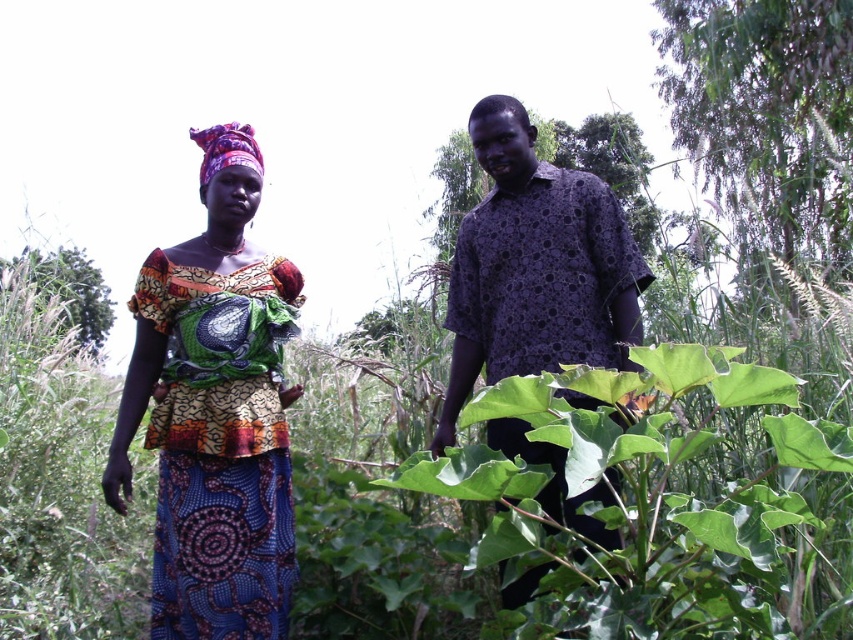
You are a farmer checking the growth of your plants. You notice the green leafy plant at center and the purple printed shirt at center. Which object is shorter?

The green leafy plant at center is not as tall as the purple printed shirt at center, so the plant is shorter.

You are a photographer holding a camera and want to capture a clear photo of the green leafy plant at center. Considering the distance between the camera and the plant, is it possible to take a clear photo without moving closer?

The green leafy plant at center and camera are 4.40 feet apart from each other, so yes, it is possible to take a clear photo without moving closer as most cameras can focus at that distance.